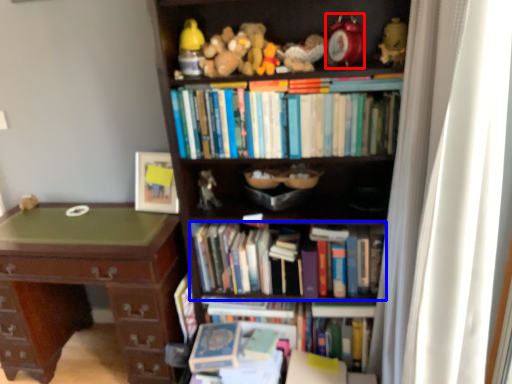
Question: Which point is closer to the camera, toy (highlighted by a red box) or book (highlighted by a blue box)?

Choices:
 (A) toy
 (B) book

Answer: (A)